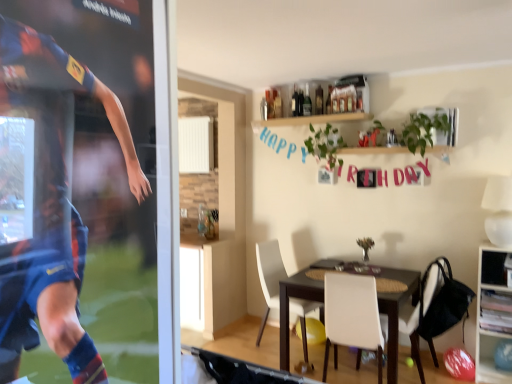
Question: Is the position of wooden cabinet at right less distant than that of white matte chair at center, acting as the third chair starting from the left?

Choices:
 (A) yes
 (B) no

Answer: (B)

Question: From a real-world perspective, is wooden cabinet at right positioned under white matte chair at center, acting as the third chair starting from the left, based on gravity?

Choices:
 (A) no
 (B) yes

Answer: (A)

Question: Is wooden cabinet at right looking in the opposite direction of white matte chair at center, the 1th chair when ordered from right to left?

Choices:
 (A) yes
 (B) no

Answer: (B)

Question: Does wooden cabinet at right appear on the left side of white matte chair at center, acting as the third chair starting from the left?

Choices:
 (A) yes
 (B) no

Answer: (B)

Question: Can you confirm if wooden cabinet at right is shorter than white matte chair at center, the 1th chair when ordered from right to left?

Choices:
 (A) yes
 (B) no

Answer: (B)

Question: Does wooden cabinet at right have a larger size compared to white matte chair at center, the 1th chair when ordered from right to left?

Choices:
 (A) yes
 (B) no

Answer: (B)

Question: From a real-world perspective, is dark brown wooden table at center positioned under white matte chair at center, which ranks as the 2th chair in left-to-right order, based on gravity?

Choices:
 (A) yes
 (B) no

Answer: (A)

Question: Is dark brown wooden table at center wider than white matte chair at center, which appears as the 2th chair when viewed from the right?

Choices:
 (A) no
 (B) yes

Answer: (B)

Question: Does dark brown wooden table at center come behind white matte chair at center, which appears as the 2th chair when viewed from the right?

Choices:
 (A) yes
 (B) no

Answer: (A)

Question: Is dark brown wooden table at center facing towards white matte chair at center, which ranks as the 2th chair in left-to-right order?

Choices:
 (A) no
 (B) yes

Answer: (B)

Question: Can you confirm if dark brown wooden table at center is bigger than white matte chair at center, which appears as the 2th chair when viewed from the right?

Choices:
 (A) yes
 (B) no

Answer: (A)

Question: Is dark brown wooden table at center shorter than white matte chair at center, which appears as the 2th chair when viewed from the right?

Choices:
 (A) yes
 (B) no

Answer: (A)

Question: Does white matte chair at center, which appears as the 2th chair when viewed from the right, have a smaller size compared to dark brown wooden table at center?

Choices:
 (A) no
 (B) yes

Answer: (B)